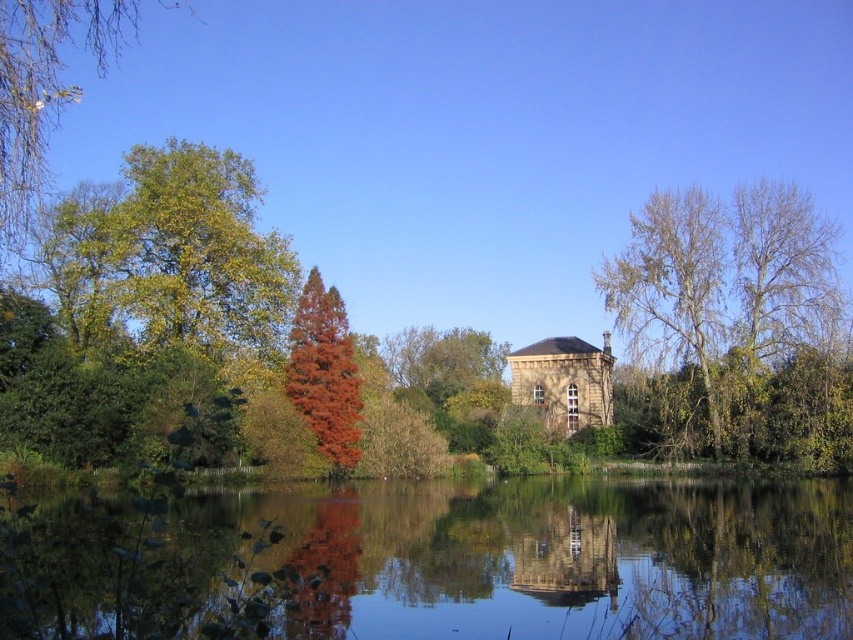
Question: Considering the real-world distances, which object is closest to the smooth stone tower at center?

Choices:
 (A) reddish-brown coniferous tree at center
 (B) bare branches at right
 (C) transparent water at center
 (D) green leafy tree at upper left

Answer: (C)

Question: Is green leafy tree at upper left further to camera compared to reddish-brown coniferous tree at center?

Choices:
 (A) no
 (B) yes

Answer: (A)

Question: Does transparent water at center have a lesser width compared to green leafy tree at upper left?

Choices:
 (A) no
 (B) yes

Answer: (B)

Question: Is transparent water at center positioned before reddish-brown coniferous tree at center?

Choices:
 (A) yes
 (B) no

Answer: (A)

Question: Which point is farther to the camera?

Choices:
 (A) (596, 595)
 (B) (312, 512)

Answer: (B)

Question: Among these points, which one is farthest from the camera?

Choices:
 (A) (328, 332)
 (B) (589, 516)
 (C) (531, 536)

Answer: (A)